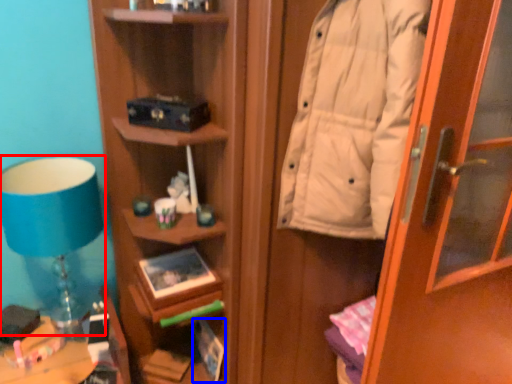
Question: Which object is closer to the camera taking this photo, table lamp (highlighted by a red box) or book (highlighted by a blue box)?

Choices:
 (A) table lamp
 (B) book

Answer: (A)